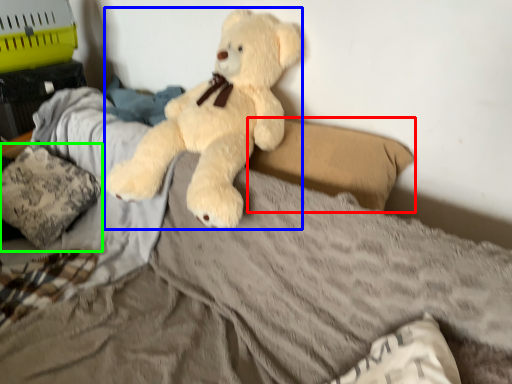
Question: Which is farther away from pillow (highlighted by a red box)? teddy bear (highlighted by a blue box) or pillow (highlighted by a green box)?

Choices:
 (A) teddy bear
 (B) pillow

Answer: (B)